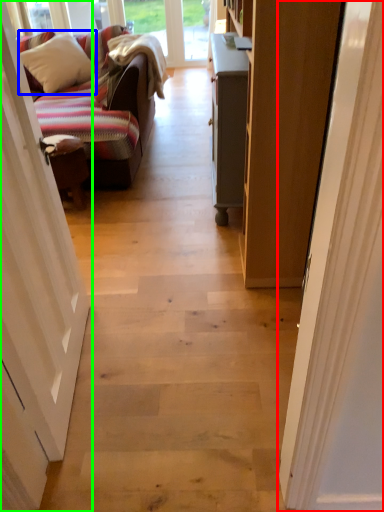
Question: Based on their relative distances, which object is nearer to door (highlighted by a red box)? Choose from pillow (highlighted by a blue box) and door (highlighted by a green box).

Choices:
 (A) pillow
 (B) door

Answer: (B)